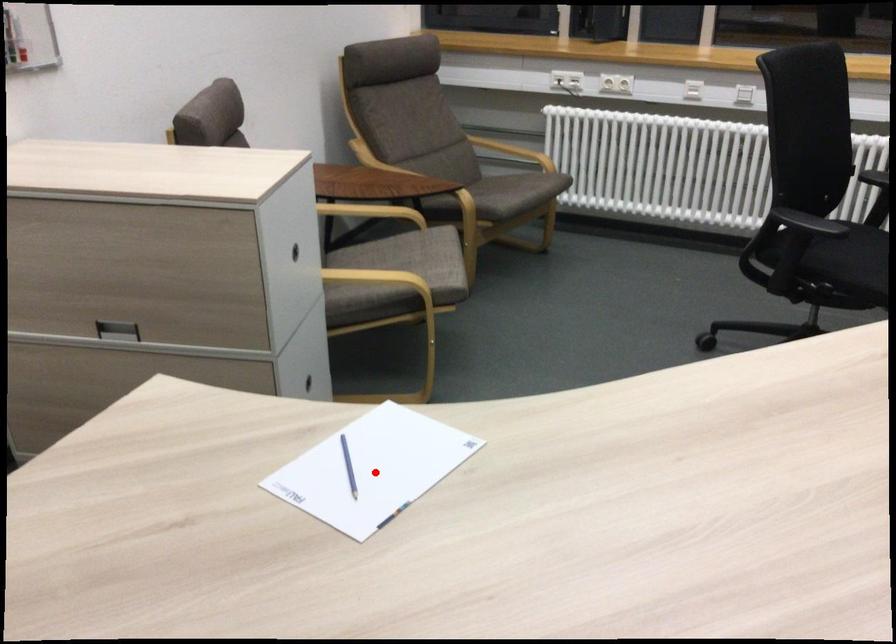
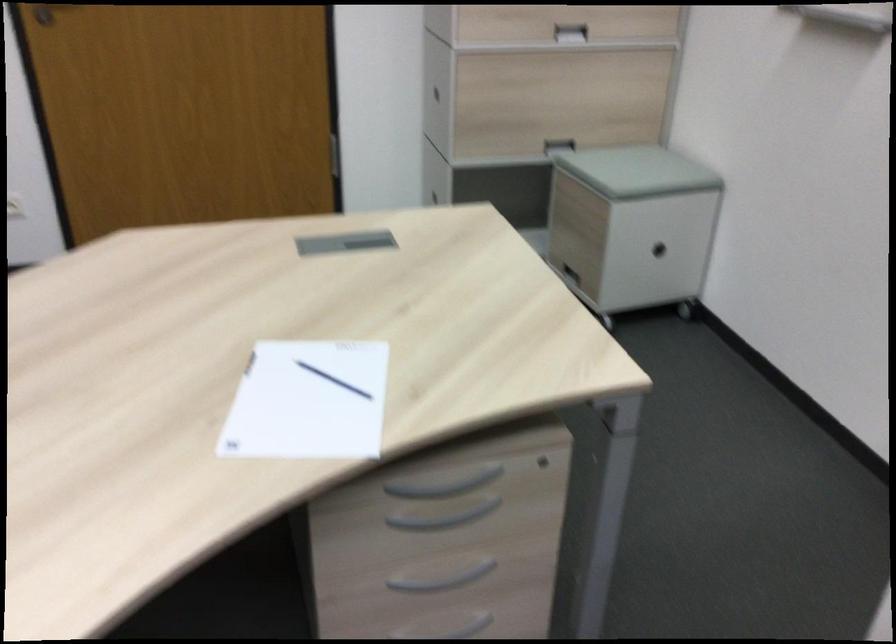
In the second image, find the point that corresponds to the highlighted location in the first image.

(307, 402)